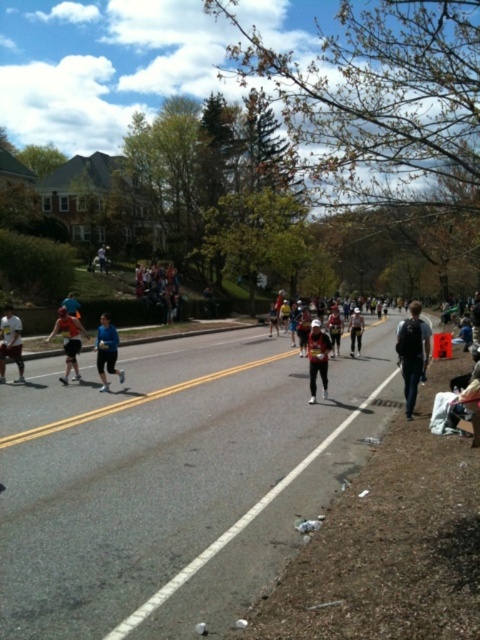
Question: Which of the following is the farthest from the observer?

Choices:
 (A) (337, 326)
 (B) (105, 342)

Answer: (A)

Question: Does matte blue shirt at upper center have a larger size compared to matte black running outfit at center?

Choices:
 (A) no
 (B) yes

Answer: (B)

Question: From the image, what is the correct spatial relationship of dark gray backpack at right in relation to white athletic shorts at left?

Choices:
 (A) below
 (B) above

Answer: (A)

Question: Is matte black shorts at center positioned in front of matte white helmet at center?

Choices:
 (A) no
 (B) yes

Answer: (A)

Question: Which is nearer to the white reflective vest at center?

Choices:
 (A) blue fabric runner at center
 (B) matte blue shirt at upper center
 (C) matte white helmet at center

Answer: (C)

Question: Which point is farther to the camera?

Choices:
 (A) (312, 385)
 (B) (349, 328)
 (C) (331, 330)

Answer: (B)